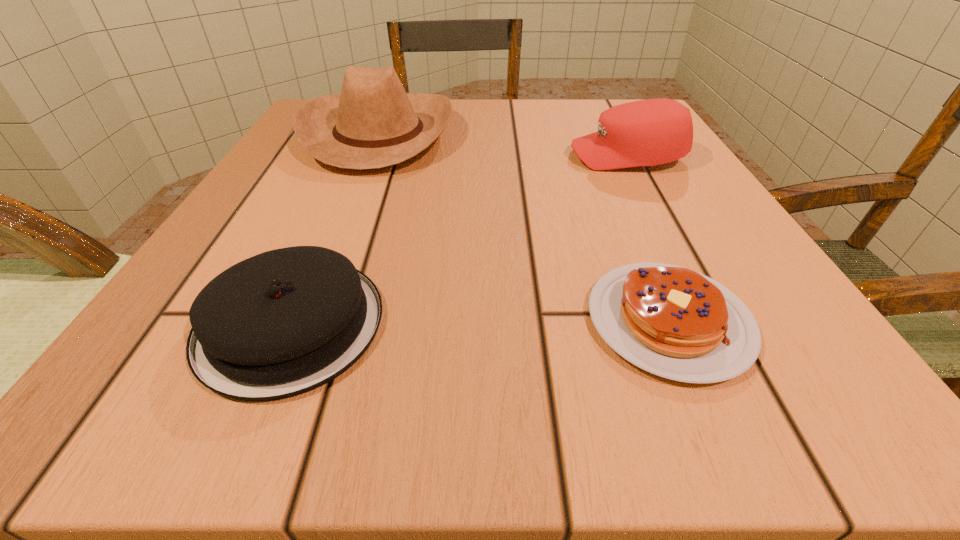
Identify the location of free location that satisfies the following two spatial constraints: 1. on the front-facing side of the shorter pancake; 2. on the right side of the tallest object. (305, 321).

Where is `blank area in the image that satisfies the following two spatial constraints: 1. on the front-facing side of the cowboy hat; 2. on the left side of the shorter pancake`? blank area in the image that satisfies the following two spatial constraints: 1. on the front-facing side of the cowboy hat; 2. on the left side of the shorter pancake is located at coordinates (305, 321).

Where is `vacant space that satisfies the following two spatial constraints: 1. on the front-facing side of the cowboy hat; 2. on the right side of the right pancake`? vacant space that satisfies the following two spatial constraints: 1. on the front-facing side of the cowboy hat; 2. on the right side of the right pancake is located at coordinates (305, 321).

Identify the location of free location that satisfies the following two spatial constraints: 1. on the front-facing side of the tallest object; 2. on the front side of the second shortest object. 304,324.